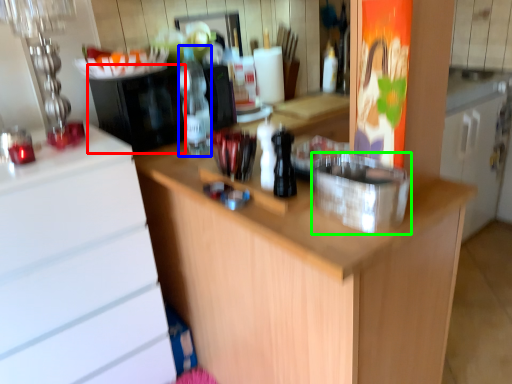
Question: Which object is the closest to the appliance (highlighted by a red box)? Choose among these: bottle (highlighted by a blue box) or appliance (highlighted by a green box).

Choices:
 (A) bottle
 (B) appliance

Answer: (A)